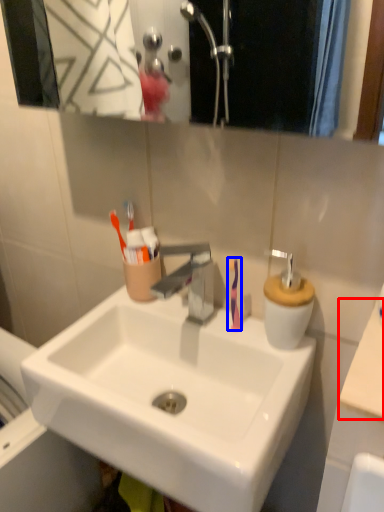
Question: Which of the following is the farthest to the observer, counter top (highlighted by a red box) or toothbrush (highlighted by a blue box)?

Choices:
 (A) counter top
 (B) toothbrush

Answer: (B)